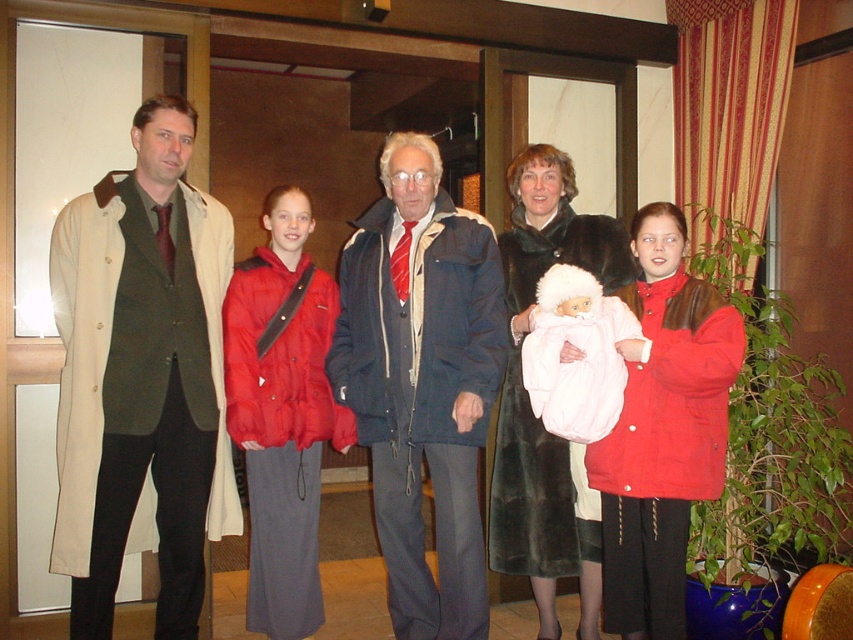
You are a fashion designer observing the group and want to arrange the matte beige coat at left and the velvet black coat at center for a photoshoot. Which coat should you move to the right to place them side by side without overlapping?

The matte beige coat at left should be moved to the right so it aligns next to the velvet black coat at center, as it is currently on the left side of the velvet black coat at center.

You are organizing a coat rack for the family in the image. The matte black coat at center belongs to an adult, and the matte red coat at right belongs to a child. Which coat should you place on the higher hook to accommodate their sizes?

The matte black coat at center is bigger than the matte red coat at right, so it should be placed on the higher hook to accommodate its larger size.